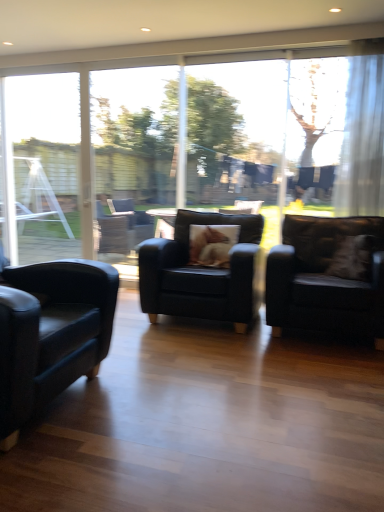
Question: From a real-world perspective, does brown furry pillow at center sit lower than transparent glass screen door at center?

Choices:
 (A) yes
 (B) no

Answer: (A)

Question: Can you see brown furry pillow at center touching transparent glass screen door at center?

Choices:
 (A) yes
 (B) no

Answer: (B)

Question: Is brown furry pillow at center positioned with its back to transparent glass screen door at center?

Choices:
 (A) no
 (B) yes

Answer: (A)

Question: Is brown furry pillow at center bigger than transparent glass screen door at center?

Choices:
 (A) yes
 (B) no

Answer: (B)

Question: Could you tell me if brown furry pillow at center is turned towards transparent glass screen door at center?

Choices:
 (A) yes
 (B) no

Answer: (B)

Question: From a real-world perspective, is matte black armchair at center, arranged as the second chair when viewed from the left, above or below transparent glass screen door at center?

Choices:
 (A) above
 (B) below

Answer: (B)

Question: Is matte black armchair at center, arranged as the second chair when viewed from the left, bigger or smaller than transparent glass screen door at center?

Choices:
 (A) big
 (B) small

Answer: (A)

Question: Would you say matte black armchair at center, arranged as the second chair when viewed from the left, is inside or outside transparent glass screen door at center?

Choices:
 (A) outside
 (B) inside

Answer: (A)

Question: Is matte black armchair at center, arranged as the second chair when viewed from the left, wider or thinner than transparent glass screen door at center?

Choices:
 (A) thin
 (B) wide

Answer: (B)

Question: In terms of size, does brown furry pillow at center appear bigger or smaller than velvet beige pillow at right?

Choices:
 (A) big
 (B) small

Answer: (A)

Question: From their relative heights in the image, would you say brown furry pillow at center is taller or shorter than velvet beige pillow at right?

Choices:
 (A) tall
 (B) short

Answer: (B)

Question: Considering the positions of point (213, 237) and point (359, 249), is point (213, 237) closer or farther from the camera than point (359, 249)?

Choices:
 (A) farther
 (B) closer

Answer: (A)

Question: Which is correct: brown furry pillow at center is inside velvet beige pillow at right, or outside of it?

Choices:
 (A) outside
 (B) inside

Answer: (A)

Question: Is point (168, 182) positioned closer to the camera than point (281, 265)?

Choices:
 (A) farther
 (B) closer

Answer: (A)

Question: From a real-world perspective, is transparent glass screen door at center physically located above or below matte black armchair at right, the 1th chair in the right-to-left sequence?

Choices:
 (A) above
 (B) below

Answer: (A)